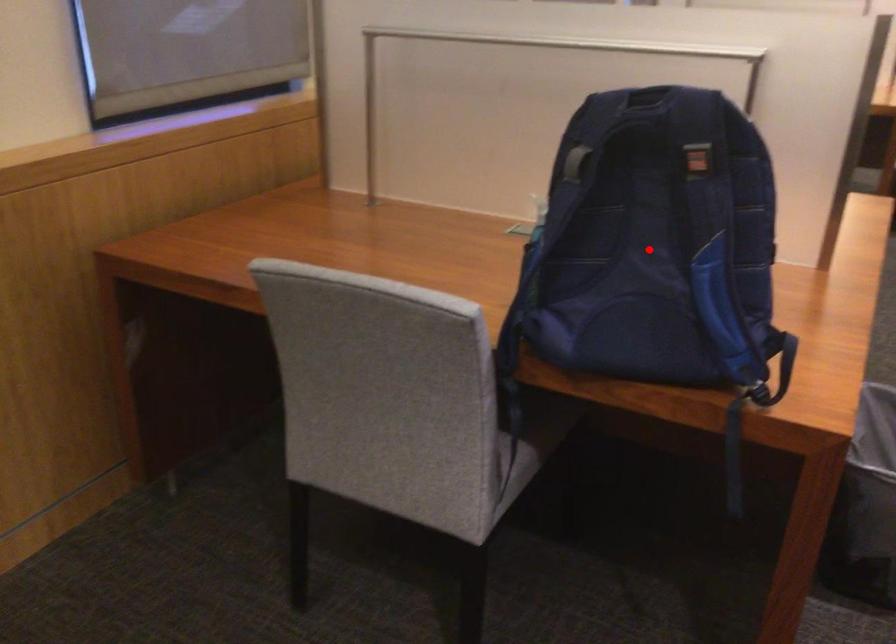
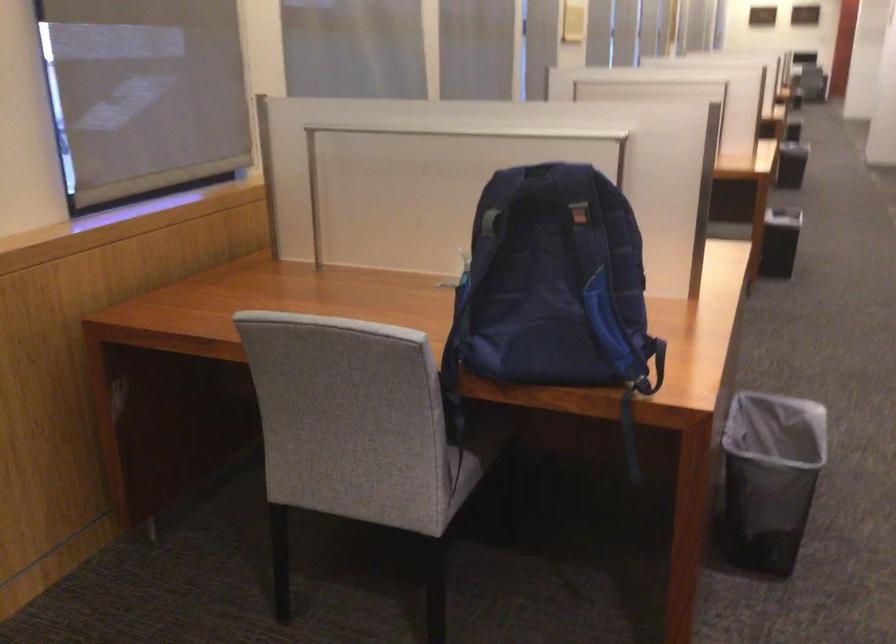
Where in the second image is the point corresponding to the highlighted location from the first image?

(552, 281)